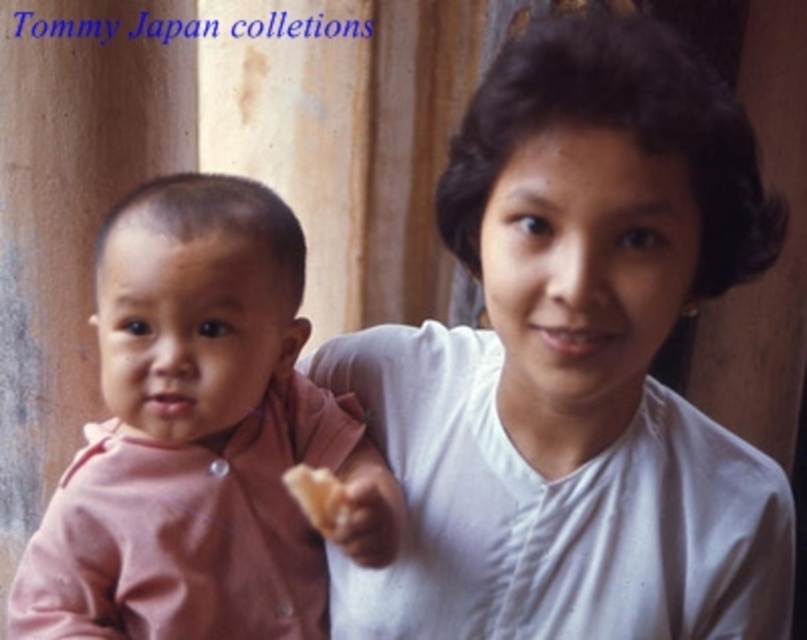
You are a photographer setting up a shot of the pink fabric baby at center and the white crumbly bread at center. You need to ensure both subjects are fully visible in the frame. Given that your camera has a maximum width capacity of 20 cm, can you fit both subjects side by side without cropping?

The pink fabric baby at center is wider than the white crumbly bread at center. Since the camera can only accommodate up to 20 cm, you need to check the combined width of both subjects. If their total width exceeds 20 cm, they won

You are a photographer setting up for a closeup shot of the white crumbly bread at center. The white matte shirt at upper right might distract the focus. Can you move the bread closer to the camera so that it is at least 30 centimeters away from the shirt?

The white matte shirt at upper right and white crumbly bread at center are currently 25.15 centimeters apart. To achieve the required 30 centimeters, you would need to move the white crumbly bread at center further away from the white matte shirt at upper right, increasing the distance between them.